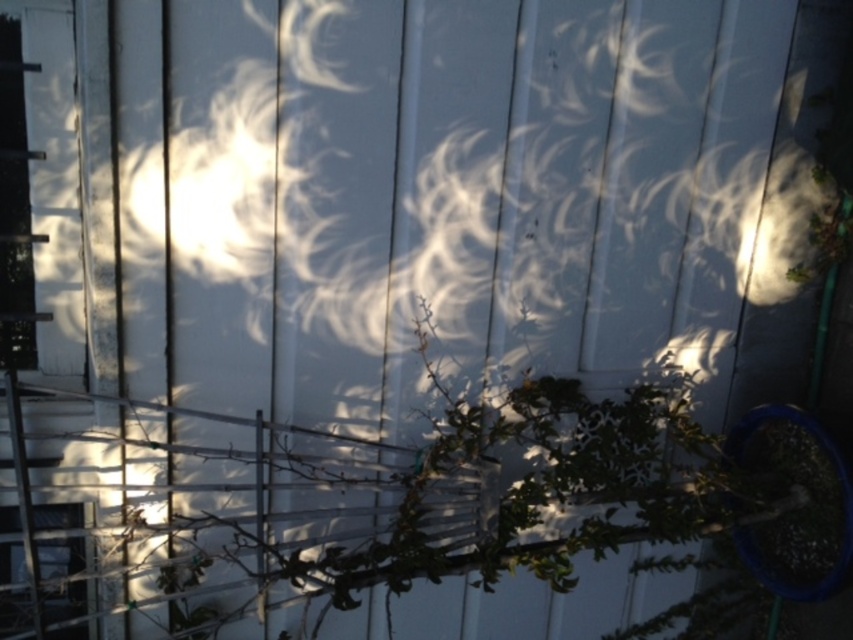
Question: Which point appears farthest from the camera in this image?

Choices:
 (A) (573, 464)
 (B) (84, 563)

Answer: (A)

Question: Which point is closer to the camera?

Choices:
 (A) (80, 502)
 (B) (561, 563)

Answer: (A)

Question: Can you confirm if green leafy plant at center is smaller than transparent glass window at lower left?

Choices:
 (A) no
 (B) yes

Answer: (A)

Question: Considering the relative positions of green leafy plant at center and transparent glass window at lower left in the image provided, where is green leafy plant at center located with respect to transparent glass window at lower left?

Choices:
 (A) below
 (B) above

Answer: (B)

Question: Among these points, which one is nearest to the camera?

Choices:
 (A) (70, 515)
 (B) (190, 630)

Answer: (B)

Question: Does green leafy plant at center appear under transparent glass window at lower left?

Choices:
 (A) yes
 (B) no

Answer: (B)